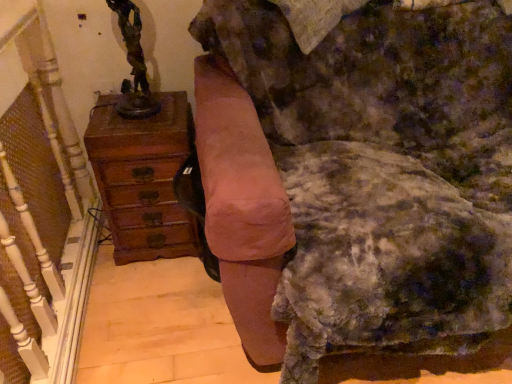
At what (x,y) coordinates should I click in order to perform the action: click on vacant space in bronze statue at upper left (from a real-world perspective). Please return your answer as a coordinate pair (x, y). Looking at the image, I should click on (140, 104).